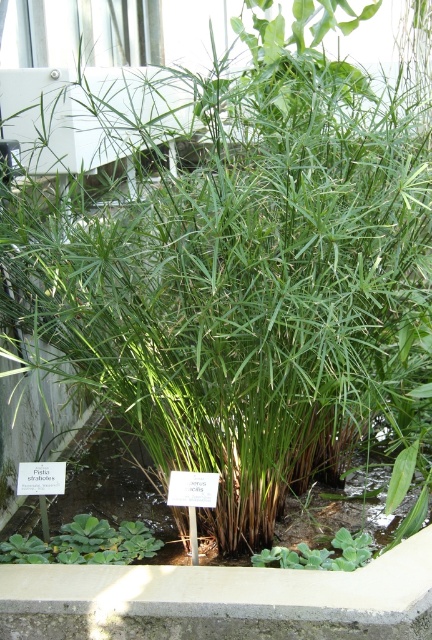
Question: Does concrete ledge at center appear over green leafy plant at lower left?

Choices:
 (A) yes
 (B) no

Answer: (A)

Question: Which point is farther to the camera?

Choices:
 (A) green leafy plant at lower left
 (B) concrete ledge at center

Answer: (A)

Question: Is concrete ledge at center positioned in front of green leafy plant at lower center?

Choices:
 (A) no
 (B) yes

Answer: (B)

Question: Which point appears farthest from the camera in this image?

Choices:
 (A) (218, 620)
 (B) (76, 544)

Answer: (B)

Question: Which of these objects is positioned closest to the green leafy plant at lower center?

Choices:
 (A) green leafy plant at lower left
 (B) concrete ledge at center

Answer: (B)

Question: Is concrete ledge at center to the left of green leafy plant at lower center from the viewer's perspective?

Choices:
 (A) no
 (B) yes

Answer: (B)